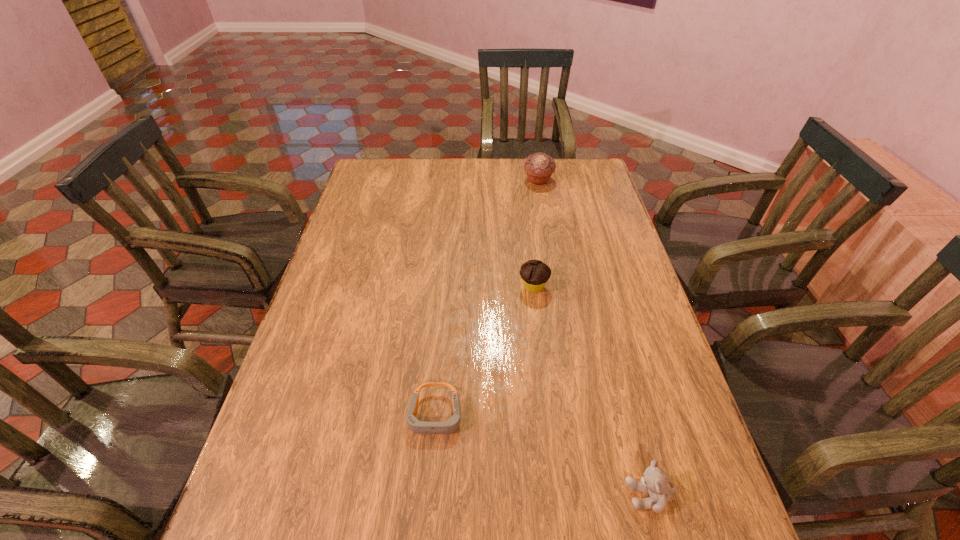
Locate which object ranks third in proximity to the third farthest object. Please provide its 2D coordinates. Your answer should be formatted as a tuple, i.e. [(x, y)], where the tuple contains the x and y coordinates of a point satisfying the conditions above.

[(539, 167)]

Where is `free space that satisfies the following two spatial constraints: 1. on the back side of the nearer muffin; 2. on the left side of the taller muffin`? free space that satisfies the following two spatial constraints: 1. on the back side of the nearer muffin; 2. on the left side of the taller muffin is located at coordinates (520, 180).